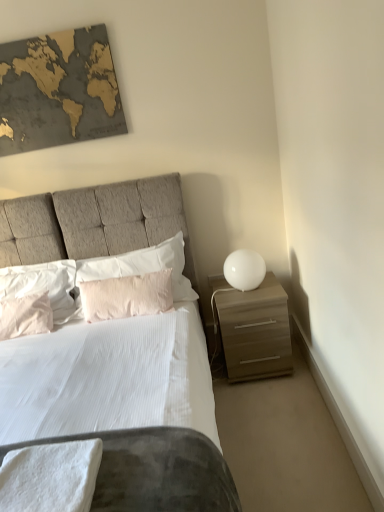
Question: Is matte brown nightstand at right touching gold textured map at upper left?

Choices:
 (A) no
 (B) yes

Answer: (A)

Question: Does matte brown nightstand at right appear on the left side of gold textured map at upper left?

Choices:
 (A) yes
 (B) no

Answer: (B)

Question: Considering the relative sizes of matte brown nightstand at right and gold textured map at upper left in the image provided, is matte brown nightstand at right thinner than gold textured map at upper left?

Choices:
 (A) yes
 (B) no

Answer: (B)

Question: Is matte brown nightstand at right closer to camera compared to gold textured map at upper left?

Choices:
 (A) yes
 (B) no

Answer: (A)

Question: Is matte brown nightstand at right positioned far away from gold textured map at upper left?

Choices:
 (A) no
 (B) yes

Answer: (B)

Question: Would you say gold textured map at upper left is inside or outside pink cotton pillow at left, the first pillow from the left?

Choices:
 (A) outside
 (B) inside

Answer: (A)

Question: In the image, is gold textured map at upper left positioned in front of or behind pink cotton pillow at left, the first pillow from the left?

Choices:
 (A) front
 (B) behind

Answer: (B)

Question: In the image, is gold textured map at upper left on the left side or the right side of pink cotton pillow at left, the first pillow from the left?

Choices:
 (A) left
 (B) right

Answer: (B)

Question: From a real-world perspective, relative to pink cotton pillow at left, the 4th pillow in the right-to-left sequence, is gold textured map at upper left vertically above or below?

Choices:
 (A) above
 (B) below

Answer: (A)

Question: Looking at their shapes, would you say white soft towel at lower left is wider or thinner than pale pink fabric pillow at center, which is counted as the third pillow, starting from the left?

Choices:
 (A) thin
 (B) wide

Answer: (B)

Question: Looking at the image, does white soft towel at lower left seem bigger or smaller compared to pale pink fabric pillow at center, which is counted as the third pillow, starting from the left?

Choices:
 (A) big
 (B) small

Answer: (B)

Question: Considering the positions of point (67, 476) and point (120, 281), is point (67, 476) closer or farther from the camera than point (120, 281)?

Choices:
 (A) farther
 (B) closer

Answer: (B)

Question: From the image's perspective, relative to pale pink fabric pillow at center, positioned as the second pillow in right-to-left order, is white soft towel at lower left above or below?

Choices:
 (A) below
 (B) above

Answer: (A)

Question: Would you say white soft pillow at center, the 1th pillow in the right-to-left sequence, is inside or outside white glossy sphere at right?

Choices:
 (A) inside
 (B) outside

Answer: (B)

Question: Would you say white soft pillow at center, the 4th pillow when ordered from left to right, is to the left or to the right of white glossy sphere at right in the picture?

Choices:
 (A) right
 (B) left

Answer: (B)